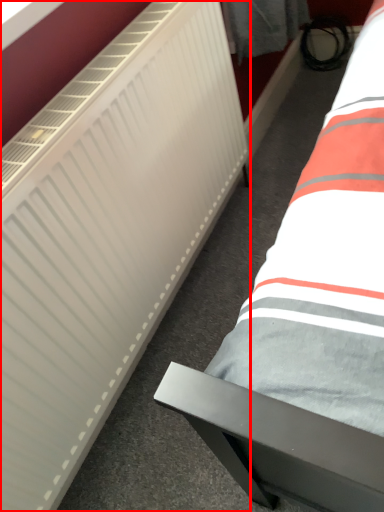
Question: From the image's perspective, what is the correct spatial positioning of radiator (annotated by the red box) in reference to bed?

Choices:
 (A) below
 (B) above

Answer: (A)